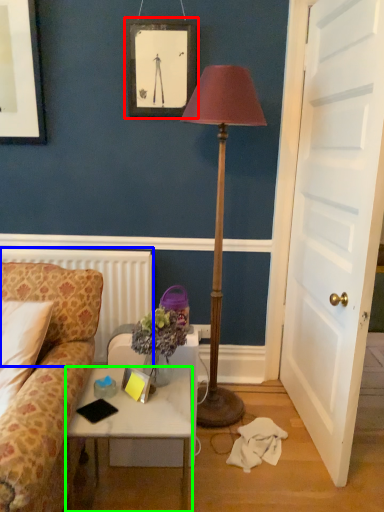
Question: Estimate the real-world distances between objects in this image. Which object is closer to picture frame (highlighted by a red box), radiator (highlighted by a blue box) or desk (highlighted by a green box)?

Choices:
 (A) radiator
 (B) desk

Answer: (A)